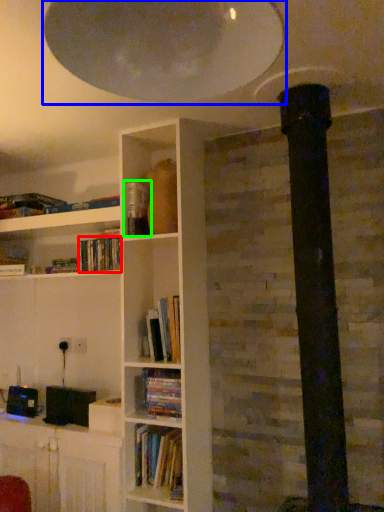
Question: Which is nearer to the book (highlighted by a red box)? exhaust hood (highlighted by a blue box) or paperback book (highlighted by a green box).

Choices:
 (A) exhaust hood
 (B) paperback book

Answer: (B)